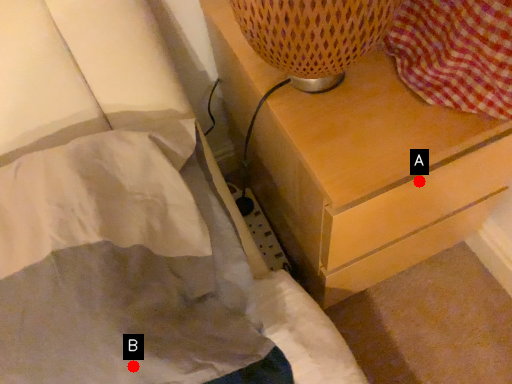
Question: Two points are circled on the image, labeled by A and B beside each circle. Which point is farther from the camera taking this photo?

Choices:
 (A) A is further
 (B) B is further

Answer: (A)